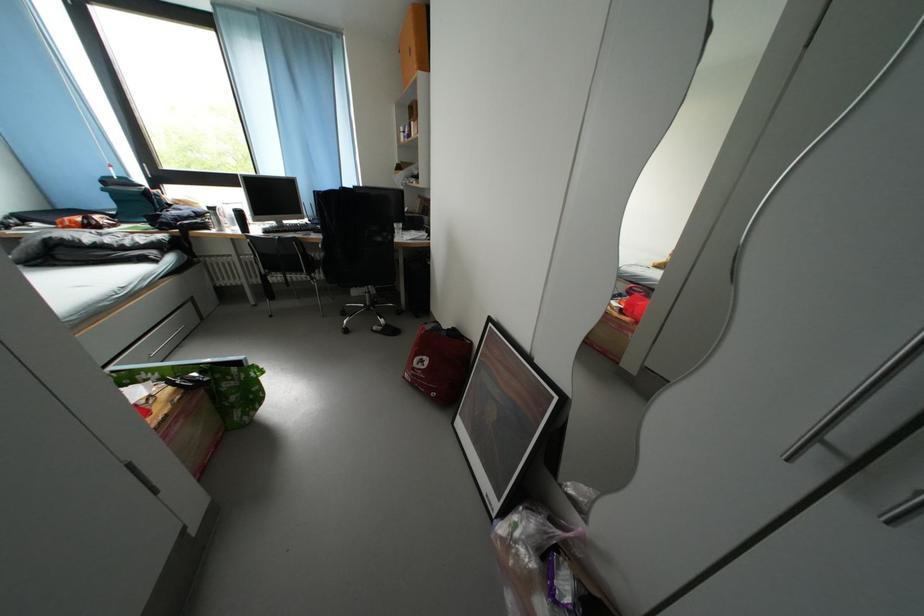
At what (x,y) coordinates should I click in order to perform the action: click on metal drawer handle. Please return your answer as a coordinate pair (x, y). Looking at the image, I should click on (162, 337).